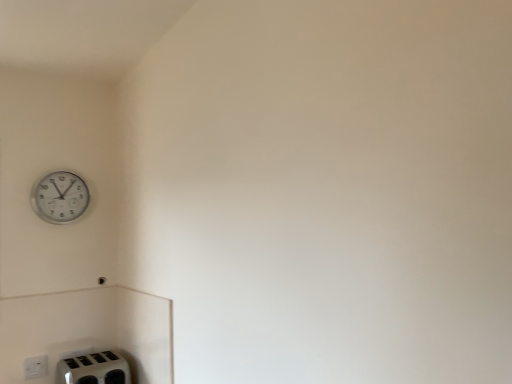
Question: Does white plastic wall clock at upper left come behind white plastic electric outlet at lower left?

Choices:
 (A) yes
 (B) no

Answer: (A)

Question: Is white plastic wall clock at upper left not inside white plastic electric outlet at lower left?

Choices:
 (A) yes
 (B) no

Answer: (A)

Question: From a real-world perspective, is white plastic wall clock at upper left located beneath white plastic electric outlet at lower left?

Choices:
 (A) yes
 (B) no

Answer: (B)

Question: Can you confirm if white plastic wall clock at upper left is bigger than white plastic electric outlet at lower left?

Choices:
 (A) yes
 (B) no

Answer: (A)

Question: Is white plastic wall clock at upper left wider than white plastic electric outlet at lower left?

Choices:
 (A) yes
 (B) no

Answer: (A)

Question: From the image's perspective, is white plastic wall clock at upper left located above or below white plastic toaster at lower left?

Choices:
 (A) below
 (B) above

Answer: (B)

Question: Is point (68, 190) closer or farther from the camera than point (110, 357)?

Choices:
 (A) closer
 (B) farther

Answer: (B)

Question: In terms of size, does white plastic wall clock at upper left appear bigger or smaller than white plastic toaster at lower left?

Choices:
 (A) small
 (B) big

Answer: (A)

Question: Is white plastic wall clock at upper left in front of or behind white plastic toaster at lower left in the image?

Choices:
 (A) behind
 (B) front

Answer: (A)

Question: Considering their positions, is white plastic wall clock at upper left located in front of or behind white plastic electric outlet at lower left?

Choices:
 (A) front
 (B) behind

Answer: (B)

Question: Looking at their shapes, would you say white plastic wall clock at upper left is wider or thinner than white plastic electric outlet at lower left?

Choices:
 (A) wide
 (B) thin

Answer: (A)

Question: Considering the positions of white plastic wall clock at upper left and white plastic electric outlet at lower left in the image, is white plastic wall clock at upper left taller or shorter than white plastic electric outlet at lower left?

Choices:
 (A) short
 (B) tall

Answer: (B)

Question: From the image's perspective, is white plastic wall clock at upper left located above or below white plastic electric outlet at lower left?

Choices:
 (A) above
 (B) below

Answer: (A)

Question: Is white plastic toaster at lower left wider or thinner than white plastic wall clock at upper left?

Choices:
 (A) thin
 (B) wide

Answer: (B)

Question: From a real-world perspective, is white plastic toaster at lower left positioned above or below white plastic wall clock at upper left?

Choices:
 (A) above
 (B) below

Answer: (B)